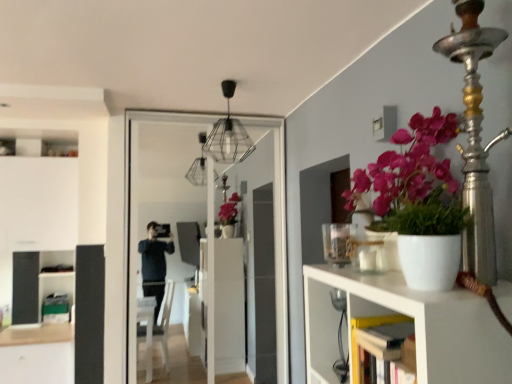
Identify the location of white matte shelf at right. This screenshot has width=512, height=384. (414, 323).

The width and height of the screenshot is (512, 384). What do you see at coordinates (414, 323) in the screenshot?
I see `white matte shelf at right` at bounding box center [414, 323].

Image resolution: width=512 pixels, height=384 pixels. Describe the element at coordinates (207, 223) in the screenshot. I see `clear glass screen door at center` at that location.

Locate an element on the screen. Image resolution: width=512 pixels, height=384 pixels. clear glass screen door at center is located at coordinates (207, 223).

Measure the distance between clear glass screen door at center and camera.

The depth of clear glass screen door at center is 10.25 feet.

Identify the location of white matte shelf at right. (414, 323).

Between white matte shelf at right and clear glass screen door at center, which one appears on the left side from the viewer's perspective?

clear glass screen door at center.

Is the position of white matte shelf at right more distant than that of clear glass screen door at center?

No.

Considering the points (428, 368) and (226, 306), which point is behind, point (428, 368) or point (226, 306)?

The point (226, 306) is farther from the camera.

From the image's perspective, between white matte shelf at right and clear glass screen door at center, who is located below?

From the image's view, white matte shelf at right is below.

From a real-world perspective, which is physically above, white matte shelf at right or clear glass screen door at center?

From a 3D spatial view, clear glass screen door at center is above.

Considering the sizes of objects white matte shelf at right and clear glass screen door at center in the image provided, who is wider, white matte shelf at right or clear glass screen door at center?

Wider between the two is white matte shelf at right.

Between white matte shelf at right and clear glass screen door at center, which one has more height?

clear glass screen door at center.

Looking at this image, does white matte shelf at right have a larger size compared to clear glass screen door at center?

Incorrect, white matte shelf at right is not larger than clear glass screen door at center.

Is white matte shelf at right situated inside clear glass screen door at center or outside?

white matte shelf at right is not enclosed by clear glass screen door at center.

In the scene shown: Is white matte shelf at right not close to clear glass screen door at center?

white matte shelf at right is far away from clear glass screen door at center.

Could you tell me if white matte shelf at right is facing clear glass screen door at center?

No.

How different are the orientations of white matte shelf at right and clear glass screen door at center in degrees?

The facing directions of white matte shelf at right and clear glass screen door at center are 88.8 degrees apart.

Find the location of a particular element. screen door behind the white matte shelf at right is located at coordinates (207, 223).

Would you say clear glass screen door at center is to the left or to the right of white matte shelf at right in the picture?

From the image, it's evident that clear glass screen door at center is to the left of white matte shelf at right.

Looking at this image, considering their positions, is clear glass screen door at center located in front of or behind white matte shelf at right?

Visually, clear glass screen door at center is located behind white matte shelf at right.

Is point (227, 305) closer to viewer compared to point (330, 332)?

No, it is not.

From the image's perspective, is clear glass screen door at center on top of white matte shelf at right?

Correct, clear glass screen door at center appears higher than white matte shelf at right in the image.

From a real-world perspective, is clear glass screen door at center over white matte shelf at right?

Yes, from a real-world perspective, clear glass screen door at center is on top of white matte shelf at right.

Can you confirm if clear glass screen door at center is wider than white matte shelf at right?

No, clear glass screen door at center is not wider than white matte shelf at right.

Can you confirm if clear glass screen door at center is shorter than white matte shelf at right?

In fact, clear glass screen door at center may be taller than white matte shelf at right.

Considering the sizes of clear glass screen door at center and white matte shelf at right in the image, is clear glass screen door at center bigger or smaller than white matte shelf at right?

In the image, clear glass screen door at center appears to be larger than white matte shelf at right.

Does clear glass screen door at center contain white matte shelf at right?

No.

Is clear glass screen door at center placed right next to white matte shelf at right?

No, clear glass screen door at center is not beside white matte shelf at right.

Is clear glass screen door at center looking in the opposite direction of white matte shelf at right?

No, white matte shelf at right is not at the back of clear glass screen door at center.

How different are the orientations of clear glass screen door at center and white matte shelf at right in degrees?

The angle between the facing direction of clear glass screen door at center and the facing direction of white matte shelf at right is 88.8 degrees.

Locate an element on the screen. Image resolution: width=512 pixels, height=384 pixels. screen door above the white matte shelf at right (from the image's perspective) is located at coordinates (207, 223).

At what (x,y) coordinates should I click in order to perform the action: click on shelf below the clear glass screen door at center (from a real-world perspective). Please return your answer as a coordinate pair (x, y). The height and width of the screenshot is (384, 512). Looking at the image, I should click on (414, 323).

You are a GUI agent. You are given a task and a screenshot of the screen. Output one action in this format:
    pyautogui.click(x=<x>, y=<y>)
    Task: Click on the shelf located in front of the clear glass screen door at center
    
    Given the screenshot: What is the action you would take?
    pyautogui.click(x=414, y=323)